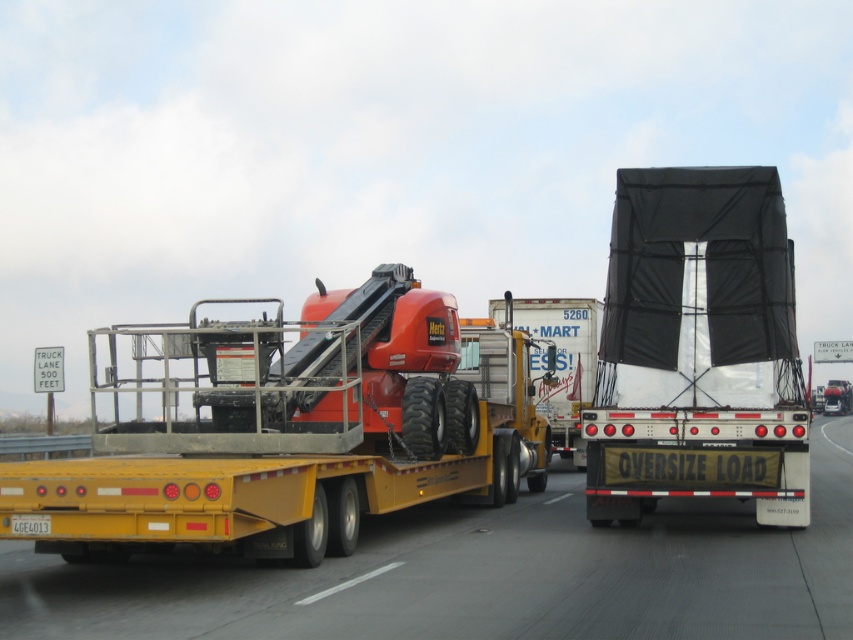
Can you confirm if matte orange tow truck at center is positioned to the left of black mesh truck at center?

Yes, matte orange tow truck at center is to the left of black mesh truck at center.

In the scene shown: Who is lower down, matte orange tow truck at center or black mesh truck at center?

black mesh truck at center is below.

You are a GUI agent. You are given a task and a screenshot of the screen. Output one action in this format:
    pyautogui.click(x=<x>, y=<y>)
    Task: Click on the matte orange tow truck at center
    The height and width of the screenshot is (640, 853).
    Given the screenshot: What is the action you would take?
    pyautogui.click(x=289, y=428)

Can you confirm if yellow metallic flatbed trailer at center is taller than white plastic license plate at lower left?

Indeed, yellow metallic flatbed trailer at center has a greater height compared to white plastic license plate at lower left.

Locate an element on the screen. The image size is (853, 640). yellow metallic flatbed trailer at center is located at coordinates (483, 573).

Find the location of a particular element. The image size is (853, 640). yellow metallic flatbed trailer at center is located at coordinates (483, 573).

Measure the distance between matte orange tow truck at center and white plastic license plate at lower left.

3.10 meters

Is point (210, 419) positioned in front of point (28, 516)?

That is False.

At what (x,y) coordinates should I click in order to perform the action: click on matte orange tow truck at center. Please return your answer as a coordinate pair (x, y). This screenshot has height=640, width=853. Looking at the image, I should click on (289, 428).